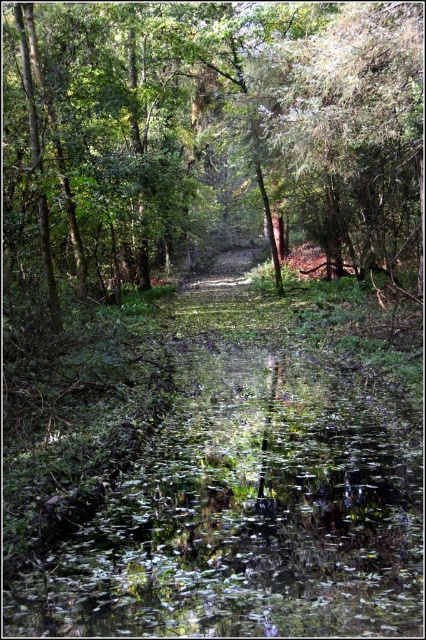
Question: Can you confirm if green leafy water at center is thinner than green leafy tree at upper right?

Choices:
 (A) yes
 (B) no

Answer: (A)

Question: Which point appears farthest from the camera in this image?

Choices:
 (A) (362, 24)
 (B) (287, 531)

Answer: (A)

Question: Does green leafy water at center appear on the right side of green leafy tree at upper right?

Choices:
 (A) no
 (B) yes

Answer: (A)

Question: Observing the image, what is the correct spatial positioning of green leafy water at center in reference to green leafy tree at upper right?

Choices:
 (A) above
 (B) below

Answer: (B)